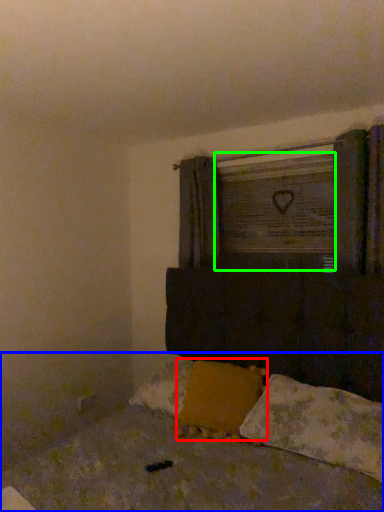
Question: Which object is positioned closest to pillow (highlighted by a red box)? Select from bed (highlighted by a blue box) and window frame (highlighted by a green box).

Choices:
 (A) bed
 (B) window frame

Answer: (A)